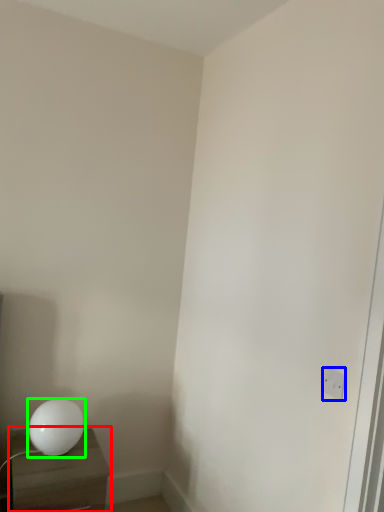
Question: Estimate the real-world distances between objects in this image. Which object is farther from nightstand (highlighted by a red box), electric outlet (highlighted by a blue box) or lamp (highlighted by a green box)?

Choices:
 (A) electric outlet
 (B) lamp

Answer: (A)